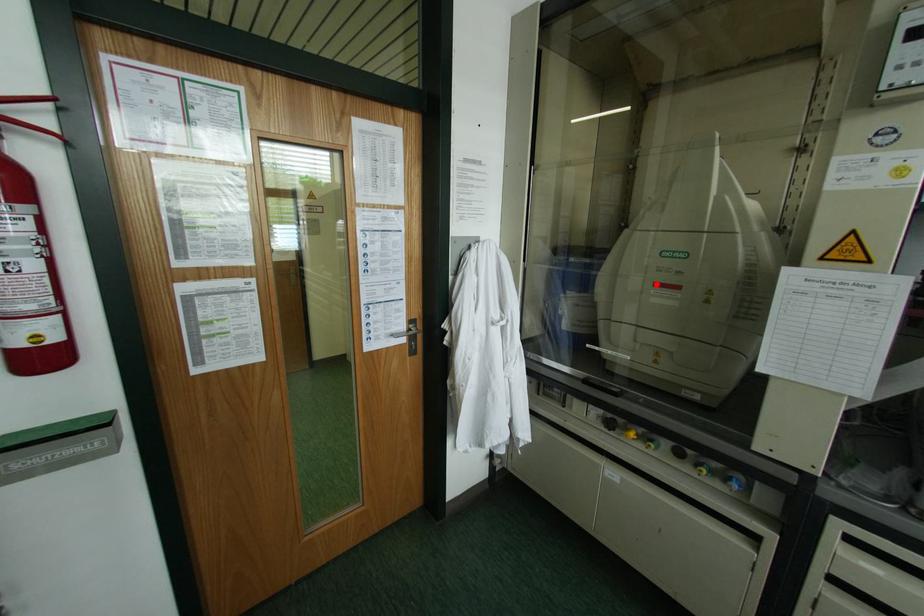
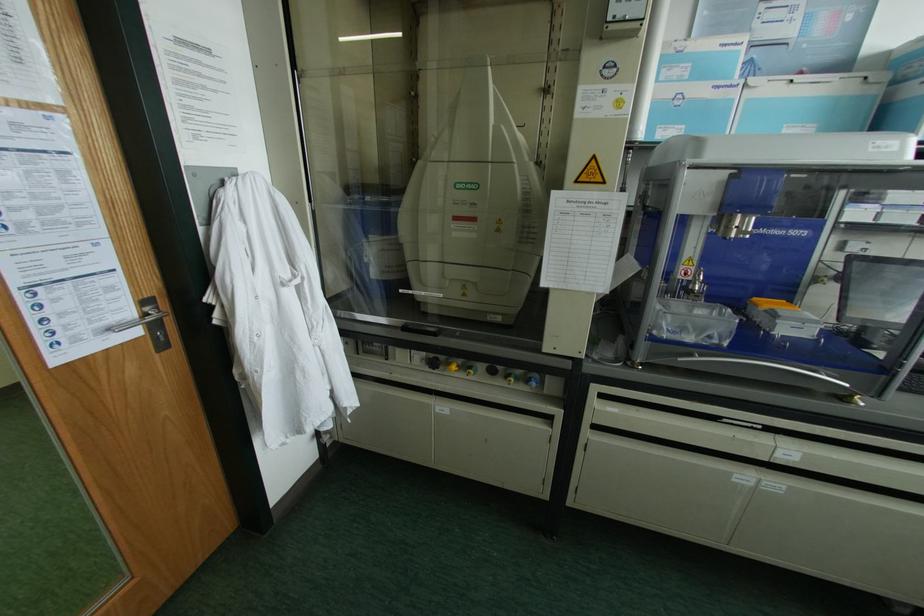
The point at the highlighted location is marked in the first image. Where is the corresponding point in the second image?

(455, 217)